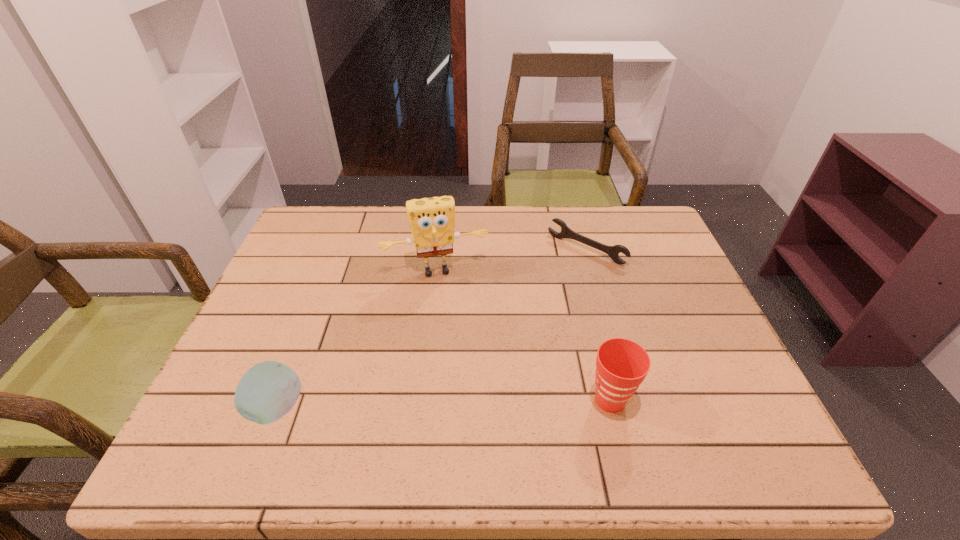
Locate an element on the screen. vacant space that satisfies the following two spatial constraints: 1. on the back side of the sponge; 2. on the left side of the shortest object is located at coordinates (439, 249).

At what (x,y) coordinates should I click in order to perform the action: click on vacant region that satisfies the following two spatial constraints: 1. on the back side of the second shortest object; 2. on the left side of the wrench. Please return your answer as a coordinate pair (x, y). The image size is (960, 540). Looking at the image, I should click on (338, 249).